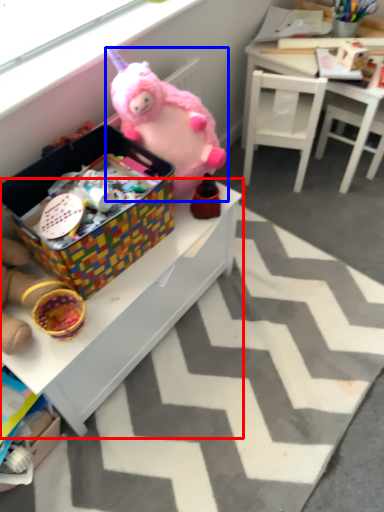
Question: Which point is further to the camera, table (highlighted by a red box) or toy (highlighted by a blue box)?

Choices:
 (A) table
 (B) toy

Answer: (B)